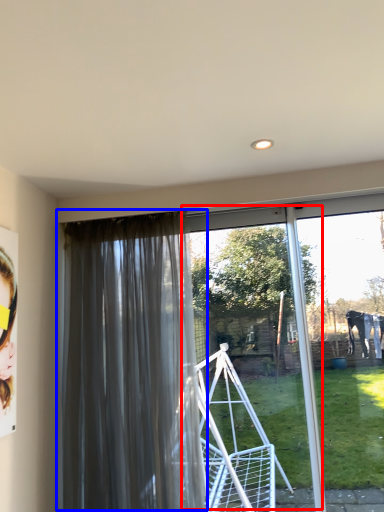
Question: Which object is closer to the camera taking this photo, screen door (highlighted by a red box) or curtain (highlighted by a blue box)?

Choices:
 (A) screen door
 (B) curtain

Answer: (B)